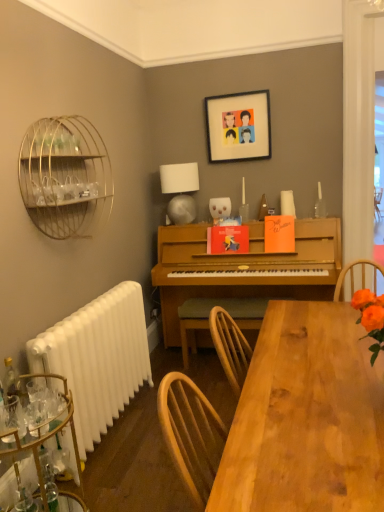
Where is `free spot above matte plastic picture frame at upper center (from a real-world perspective)`? The width and height of the screenshot is (384, 512). free spot above matte plastic picture frame at upper center (from a real-world perspective) is located at coordinates (244, 89).